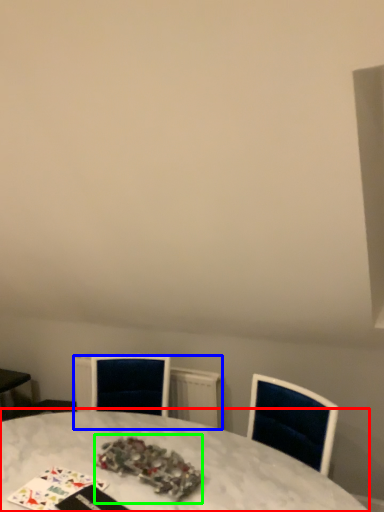
Question: Estimate the real-world distances between objects in this image. Which object is farther from table (highlighted by a red box), radiator (highlighted by a blue box) or christmas decoration (highlighted by a green box)?

Choices:
 (A) radiator
 (B) christmas decoration

Answer: (A)